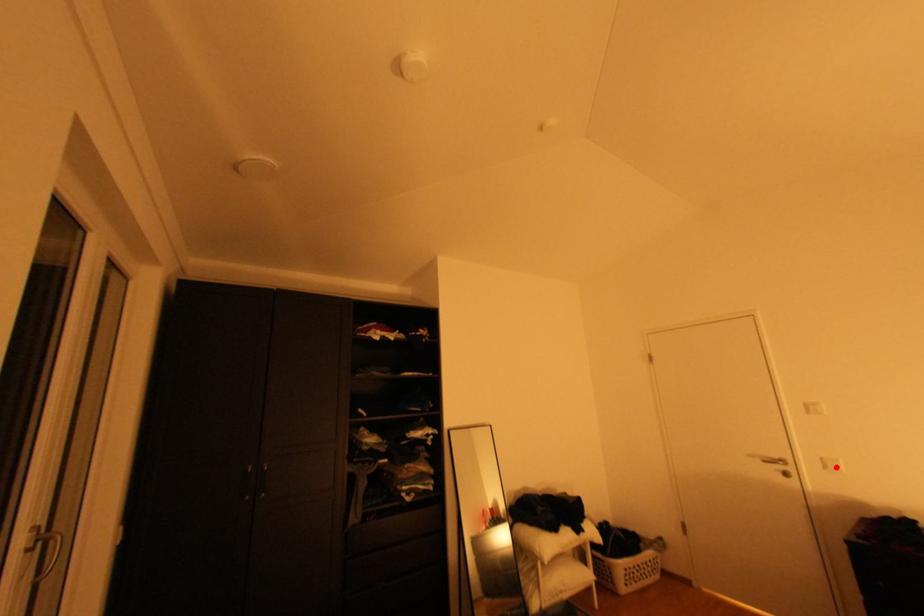
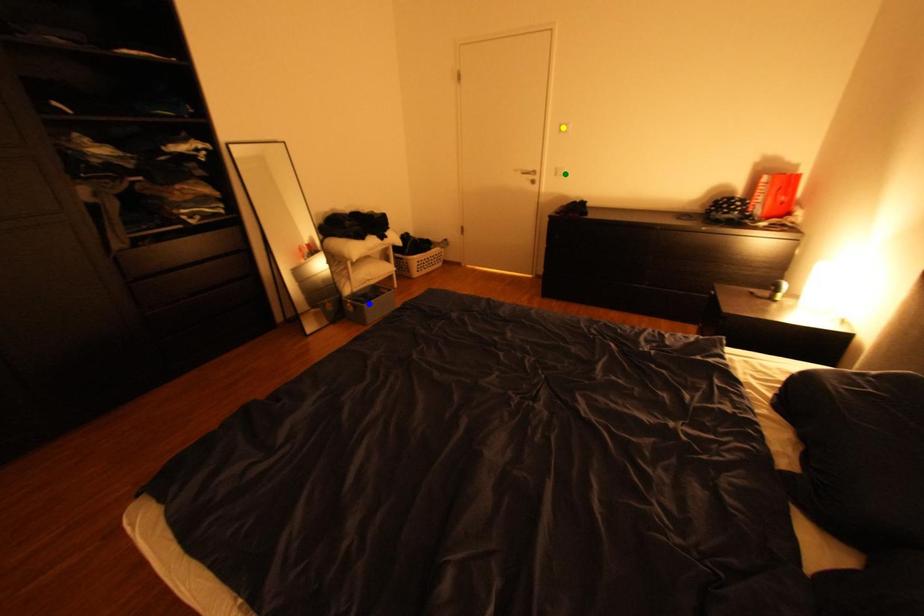
Question: I am providing you with two images of the same scene from different viewpoints. A red point is marked on the first image. You are given multiple points on the second image. In image 2, which mark is for the same physical point as the one in image 1?

Choices:
 (A) blue point
 (B) green point
 (C) yellow point

Answer: (B)